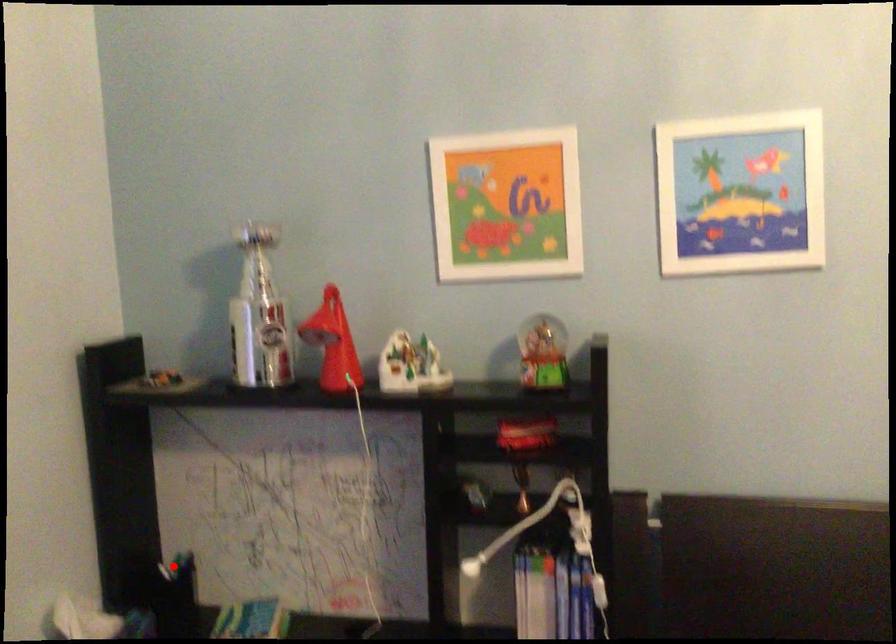
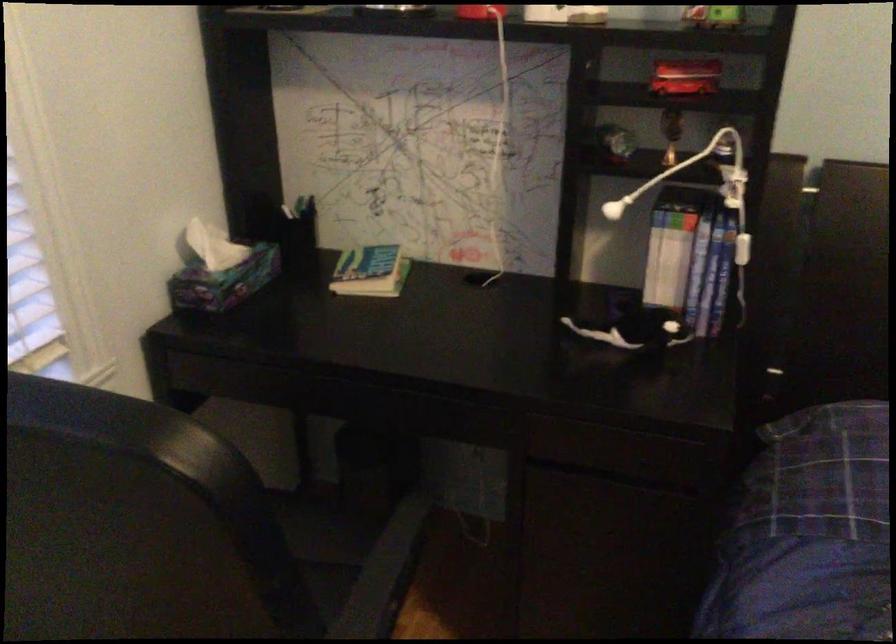
Locate, in the second image, the point that corresponds to the highlighted location in the first image.

(295, 211)